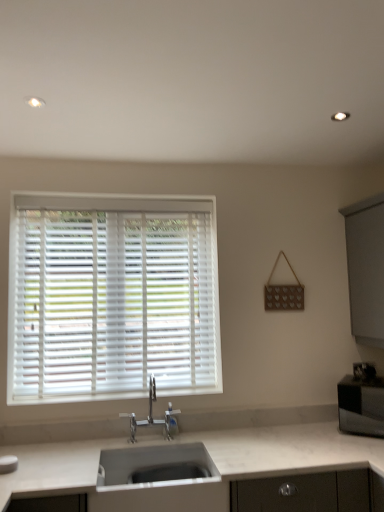
Describe the element at coordinates (155, 466) in the screenshot. I see `white matte sink at center` at that location.

Image resolution: width=384 pixels, height=512 pixels. Describe the element at coordinates (152, 416) in the screenshot. I see `polished chrome faucet at center` at that location.

You are a GUI agent. You are given a task and a screenshot of the screen. Output one action in this format:
    pyautogui.click(x=<x>, y=<y>)
    Task: Click on the white matte sink at center
    The height and width of the screenshot is (512, 384).
    Given the screenshot: What is the action you would take?
    pyautogui.click(x=155, y=466)

Is polished chrome faucet at center at the back of white matte sink at center?

No, polished chrome faucet at center is not at the back of white matte sink at center.

From a real-world perspective, is white matte sink at center on top of polished chrome faucet at center?

No, from a real-world perspective, white matte sink at center is not over polished chrome faucet at center

This screenshot has width=384, height=512. Identify the location of sink beneath the polished chrome faucet at center (from a real-world perspective). (155, 466).

From their relative heights in the image, would you say white plastic blinds at upper left is taller or shorter than white marble countertop at lower center?

In the image, white plastic blinds at upper left appears to be taller than white marble countertop at lower center.

Is white plastic blinds at upper left facing away from white marble countertop at lower center?

No, white marble countertop at lower center is not at the back of white plastic blinds at upper left.

From a real-world perspective, is white plastic blinds at upper left on top of white marble countertop at lower center?

Correct, in the physical world, white plastic blinds at upper left is higher than white marble countertop at lower center.

Is white plastic blinds at upper left thinner than white marble countertop at lower center?

Correct, the width of white plastic blinds at upper left is less than that of white marble countertop at lower center.

Is polished chrome faucet at center at the back of white marble countertop at lower center?

No, white marble countertop at lower center is not facing away from polished chrome faucet at center.

How many degrees apart are the facing directions of white marble countertop at lower center and polished chrome faucet at center?

They differ by 0.000479 degrees in their facing directions.

Is white marble countertop at lower center far from polished chrome faucet at center?

No, white marble countertop at lower center is not far from polished chrome faucet at center.

Considering the sizes of objects white marble countertop at lower center and polished chrome faucet at center in the image provided, who is shorter, white marble countertop at lower center or polished chrome faucet at center?

Standing shorter between the two is polished chrome faucet at center.

Considering their positions, is white marble countertop at lower center located in front of or behind white matte sink at center?

white marble countertop at lower center is in front of white matte sink at center.

From a real-world perspective, is white marble countertop at lower center located higher than white matte sink at center?

No, from a real-world perspective, white marble countertop at lower center is not on top of white matte sink at center.

Is point (36, 462) closer or farther from the camera than point (165, 448)?

Clearly, point (36, 462) is closer to the camera than point (165, 448).

Is polished chrome faucet at center at the back of satin black microwave at right?

No, polished chrome faucet at center is not at the back of satin black microwave at right.

Considering the positions of objects satin black microwave at right and polished chrome faucet at center in the image provided, who is behind, satin black microwave at right or polished chrome faucet at center?

satin black microwave at right is further from the camera.

From the image's perspective, which is below, satin black microwave at right or polished chrome faucet at center?

satin black microwave at right, from the image's perspective.

From a real-world perspective, is white matte sink at center located higher than white marble countertop at lower center?

Correct, in the physical world, white matte sink at center is higher than white marble countertop at lower center.

How many degrees apart are the facing directions of white matte sink at center and white marble countertop at lower center?

The angle between the facing direction of white matte sink at center and the facing direction of white marble countertop at lower center is 0.000152 degrees.

The width and height of the screenshot is (384, 512). In the image, there is a white matte sink at center. In order to click on countertop below it (from a real-world perspective) in this screenshot , I will do `click(288, 449)`.

Can you confirm if polished chrome faucet at center is positioned to the right of white marble countertop at lower center?

No.

Measure the distance from polished chrome faucet at center to white marble countertop at lower center.

polished chrome faucet at center is 15.14 inches away from white marble countertop at lower center.

From the picture: Considering the relative sizes of polished chrome faucet at center and white marble countertop at lower center in the image provided, is polished chrome faucet at center thinner than white marble countertop at lower center?

Yes.

In the image, is polished chrome faucet at center positioned in front of or behind white marble countertop at lower center?

Clearly, polished chrome faucet at center is behind white marble countertop at lower center.

The image size is (384, 512). In order to click on tap behind the white matte sink at center in this screenshot , I will do `click(152, 416)`.

The height and width of the screenshot is (512, 384). Identify the location of countertop on the right of the white plastic blinds at upper left. (288, 449).

Consider the image. Estimate the real-world distances between objects in this image. Which object is closer to polished chrome faucet at center, satin black microwave at right or white marble countertop at lower center?

Based on the image, white marble countertop at lower center appears to be nearer to polished chrome faucet at center.

When comparing their distances from polished chrome faucet at center, does white plastic blinds at upper left or white matte sink at center seem closer?

Based on the image, white matte sink at center appears to be nearer to polished chrome faucet at center.

Looking at the image, which one is located closer to white matte sink at center, white marble countertop at lower center or white plastic blinds at upper left?

white marble countertop at lower center lies closer to white matte sink at center than the other object.

Which object lies nearer to the anchor point white marble countertop at lower center, white matte sink at center or polished chrome faucet at center?

white matte sink at center is closer to white marble countertop at lower center.

Considering their positions, is white plastic blinds at upper left positioned closer to white marble countertop at lower center than white matte sink at center?

white matte sink at center.

Looking at the image, which one is located further to white matte sink at center, white marble countertop at lower center or satin black microwave at right?

satin black microwave at right.

Considering their positions, is satin black microwave at right positioned further to white marble countertop at lower center than white plastic blinds at upper left?

white plastic blinds at upper left is further to white marble countertop at lower center.

Based on their spatial positions, is satin black microwave at right or white matte sink at center further from white plastic blinds at upper left?

satin black microwave at right lies further to white plastic blinds at upper left than the other object.

Where is `sink between polished chrome faucet at center and satin black microwave at right in the horizontal direction`? This screenshot has height=512, width=384. sink between polished chrome faucet at center and satin black microwave at right in the horizontal direction is located at coordinates (155, 466).

This screenshot has width=384, height=512. What are the coordinates of `countertop located between white plastic blinds at upper left and satin black microwave at right in the left-right direction` in the screenshot? It's located at pyautogui.click(x=288, y=449).

At what (x,y) coordinates should I click in order to perform the action: click on sink between white marble countertop at lower center and polished chrome faucet at center from front to back. Please return your answer as a coordinate pair (x, y). The width and height of the screenshot is (384, 512). Looking at the image, I should click on (155, 466).

I want to click on tap between white plastic blinds at upper left and white matte sink at center from top to bottom, so pyautogui.click(x=152, y=416).